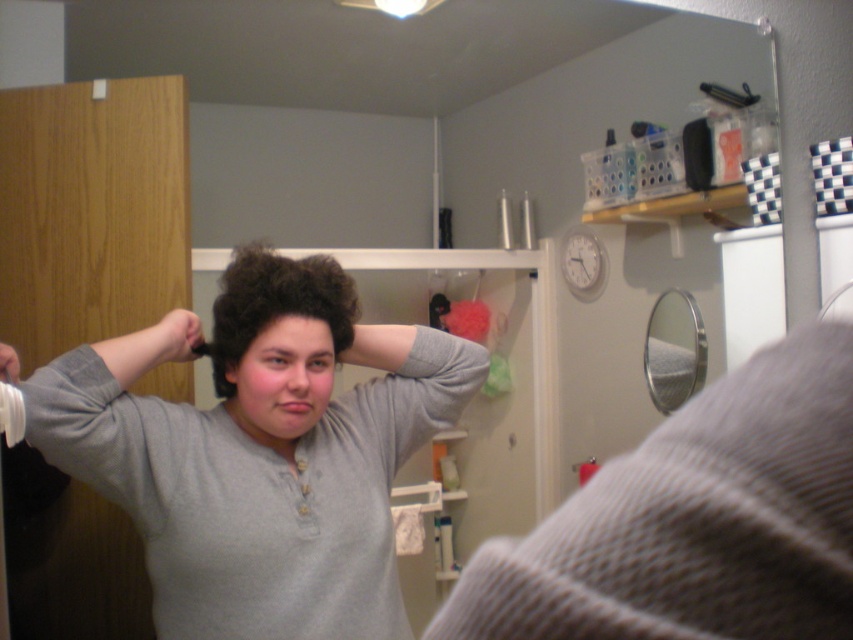
Question: Is matte gray hand at upper left to the left of smooth gray hairbrush at upper left from the viewer's perspective?

Choices:
 (A) yes
 (B) no

Answer: (B)

Question: Estimate the real-world distances between objects in this image. Which object is closer to the curly brown hair at center?

Choices:
 (A) knitted gray sweater at upper right
 (B) smooth gray hairbrush at upper left

Answer: (B)

Question: Which point is farther to the camera?

Choices:
 (A) knitted gray sweater at upper right
 (B) curly brown hair at center

Answer: (B)

Question: Does matte gray hand at upper left appear under smooth gray hairbrush at upper left?

Choices:
 (A) yes
 (B) no

Answer: (B)

Question: Which point is closer to the camera taking this photo?

Choices:
 (A) (689, 508)
 (B) (9, 362)
 (C) (167, 328)
 (D) (318, 282)

Answer: (A)

Question: Is gray matte shirt at center to the left of matte gray hand at upper left from the viewer's perspective?

Choices:
 (A) no
 (B) yes

Answer: (A)